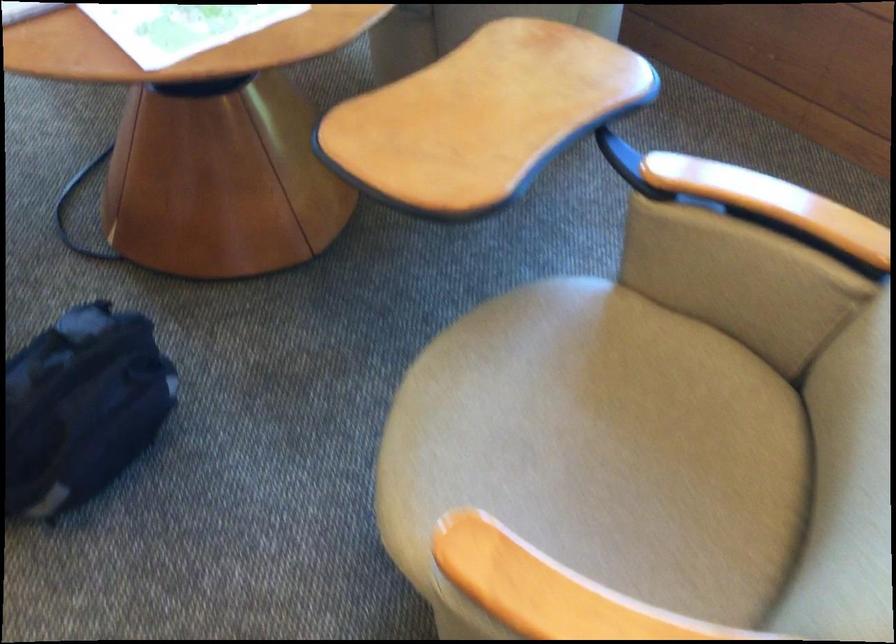
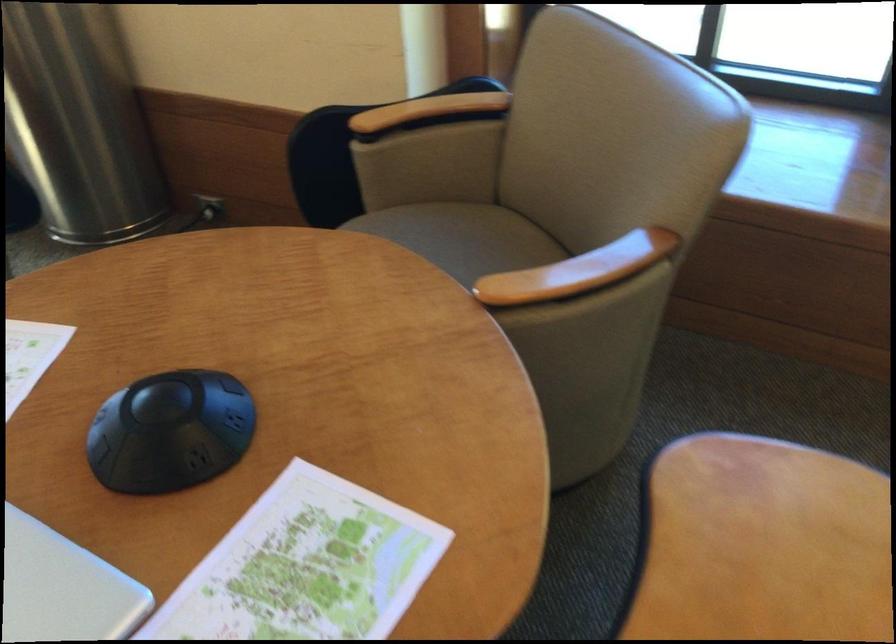
Question: The images are taken continuously from a first-person perspective. In which direction is your viewpoint rotating?

Choices:
 (A) Left
 (B) Right
 (C) Up
 (D) Down

Answer: (B)